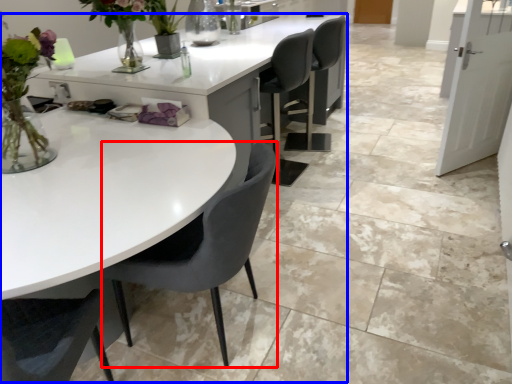
Question: Which object is closer to the camera taking this photo, chair (highlighted by a red box) or table (highlighted by a blue box)?

Choices:
 (A) chair
 (B) table

Answer: (B)